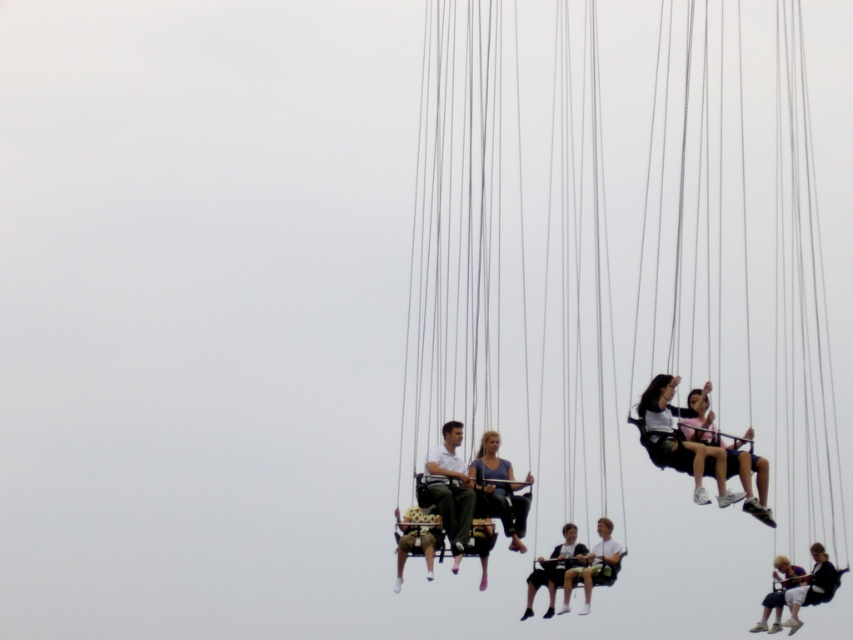
Question: Among these points, which one is farthest from the camera?

Choices:
 (A) (564, 563)
 (B) (500, 483)
 (C) (824, 550)

Answer: (C)

Question: Is light brown fabric swing at center thinner than light brown wooden swing at center?

Choices:
 (A) no
 (B) yes

Answer: (B)

Question: Which of the following is the closest to the observer?

Choices:
 (A) (532, 588)
 (B) (727, 502)
 (C) (759, 461)

Answer: (B)

Question: Is matte black swing at upper right above light brown wooden swing at center?

Choices:
 (A) no
 (B) yes

Answer: (B)

Question: Which of the following is the closest to the observer?

Choices:
 (A) (817, 564)
 (B) (503, 524)
 (C) (756, 628)
 (D) (605, 564)

Answer: (B)

Question: Can you confirm if blue fabric swing at center is smaller than light brown fabric swing at center?

Choices:
 (A) no
 (B) yes

Answer: (B)